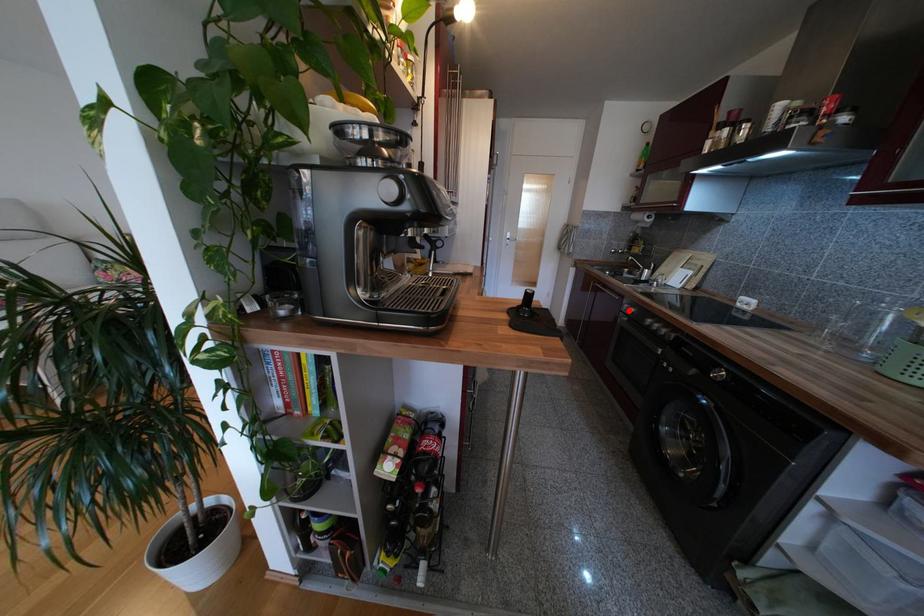
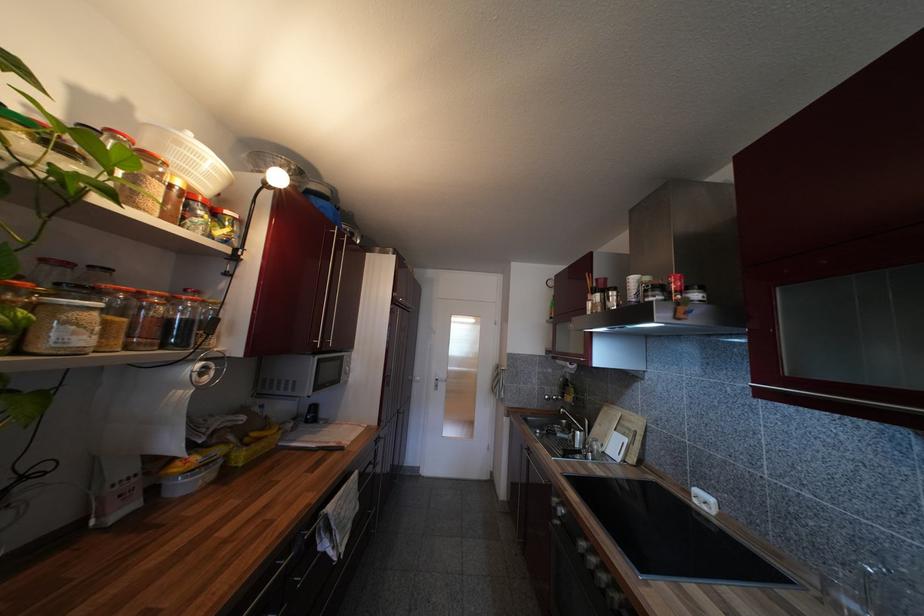
Where in the second image is the point corresponding to the highlighted location from the first image?

(557, 507)